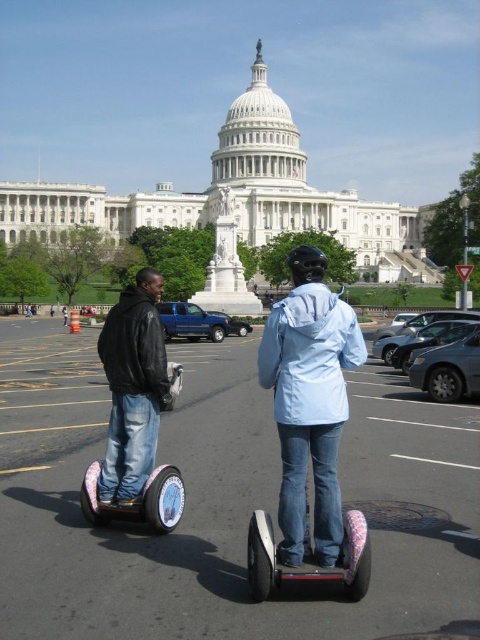
You are standing at the point marked as point (421, 538) in the image. The United States Capitol building is behind you. If you turn around, will you be facing the direction of the Capitol building?

Yes, because if you are standing at point (421, 538) and the Capitol is behind you, turning around would face you toward the Capitol building.

You are a tour guide leading a group near the United States Capitol building. You see the black leather jacket at left and the metallic blue scooter at center. Which object is closer to your current position?

The black leather jacket at left is closer to your current position because the metallic blue scooter at center is behind it.